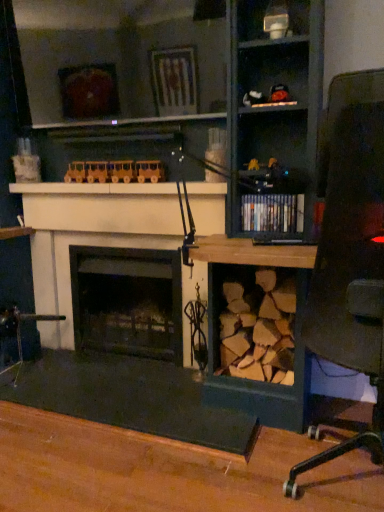
Question: Could wooden train at upper center, marked as the first toy in a back-to-front arrangement, be considered to be inside shiny black books at center?

Choices:
 (A) no
 (B) yes

Answer: (A)

Question: Considering the relative positions of shiny black books at center and wooden train at upper center, which is the 1th toy from left to right, in the image provided, is shiny black books at center in front of wooden train at upper center, which is the 1th toy from left to right,?

Choices:
 (A) no
 (B) yes

Answer: (B)

Question: Are shiny black books at center and wooden train at upper center, which is the 1th toy from left to right, far apart?

Choices:
 (A) yes
 (B) no

Answer: (B)

Question: From a real-world perspective, is shiny black books at center located higher than wooden train at upper center, which appears as the second toy when viewed from the top?

Choices:
 (A) yes
 (B) no

Answer: (B)

Question: Is shiny black books at center wider than wooden train at upper center, marked as the first toy in a back-to-front arrangement?

Choices:
 (A) yes
 (B) no

Answer: (A)

Question: From the image's perspective, is shiny black books at center above wooden train at upper center, positioned as the 1th toy in bottom-to-top order?

Choices:
 (A) yes
 (B) no

Answer: (B)

Question: Are white matte fireplace at center, positioned as the 1th fireplace in front-to-back order, and wooden desk at center making contact?

Choices:
 (A) no
 (B) yes

Answer: (A)

Question: Considering the relative positions of white matte fireplace at center, acting as the 2th fireplace starting from the back, and wooden desk at center in the image provided, is white matte fireplace at center, acting as the 2th fireplace starting from the back, to the left of wooden desk at center from the viewer's perspective?

Choices:
 (A) no
 (B) yes

Answer: (A)

Question: Are white matte fireplace at center, positioned as the 1th fireplace in front-to-back order, and wooden desk at center located far from each other?

Choices:
 (A) no
 (B) yes

Answer: (A)

Question: Is white matte fireplace at center, positioned as the 1th fireplace in front-to-back order, oriented towards wooden desk at center?

Choices:
 (A) yes
 (B) no

Answer: (A)

Question: Considering the relative sizes of white matte fireplace at center, acting as the 2th fireplace starting from the back, and wooden desk at center in the image provided, is white matte fireplace at center, acting as the 2th fireplace starting from the back, wider than wooden desk at center?

Choices:
 (A) yes
 (B) no

Answer: (B)

Question: Is white matte fireplace at center, acting as the 2th fireplace starting from the back, smaller than wooden desk at center?

Choices:
 (A) no
 (B) yes

Answer: (B)

Question: From a real-world perspective, is matte black toy car at upper center, which is counted as the 1th toy, starting from the front, on black matte fireplace at center, which appears as the 2th fireplace when viewed from the front?

Choices:
 (A) no
 (B) yes

Answer: (B)